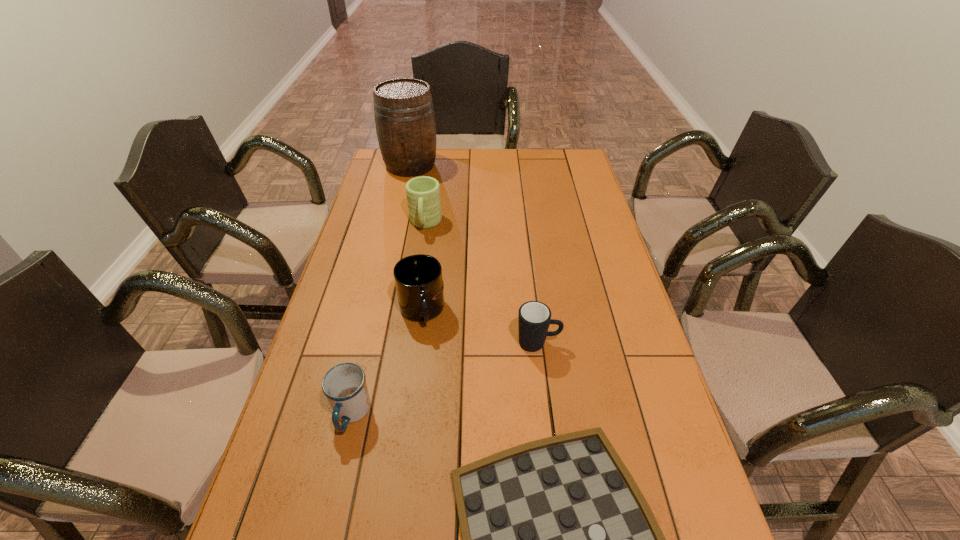
Image resolution: width=960 pixels, height=540 pixels. In order to click on cider in this screenshot , I will do `click(404, 114)`.

Identify the location of the farthest object. (404, 114).

Where is `the second farthest object`? The image size is (960, 540). the second farthest object is located at coordinates (423, 193).

Find the location of `the rightmost mug`. the rightmost mug is located at coordinates (534, 318).

Image resolution: width=960 pixels, height=540 pixels. Identify the location of the nearest mug. (344, 385).

You are a GUI agent. You are given a task and a screenshot of the screen. Output one action in this format:
    pyautogui.click(x=<x>, y=<y>)
    Task: Click on the vacant space located on the side of the farthest object near the bung hole
    
    Given the screenshot: What is the action you would take?
    pyautogui.click(x=395, y=235)

At what (x,y) coordinates should I click in order to perform the action: click on vacant space located 0.270m on the side of the farthest mug with the handle. Please return your answer as a coordinate pair (x, y). The image size is (960, 540). Looking at the image, I should click on (415, 294).

The image size is (960, 540). Identify the location of free space located 0.070m on the side of the rightmost mug with the handle. (587, 343).

You are a GUI agent. You are given a task and a screenshot of the screen. Output one action in this format:
    pyautogui.click(x=<x>, y=<y>)
    Task: Click on the blank space located 0.170m on the handle side of the nearest mug
    
    Given the screenshot: What is the action you would take?
    pyautogui.click(x=325, y=523)

The width and height of the screenshot is (960, 540). Find the location of `object positioned at the far edge`. object positioned at the far edge is located at coordinates (404, 114).